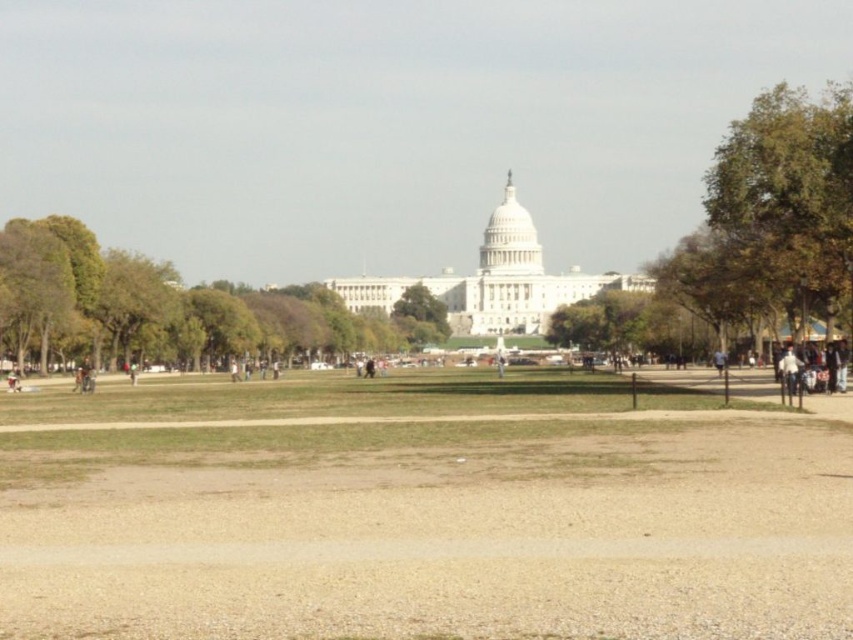
You are a tourist visiting the National Mall and notice two jackets left unattended. One is a white matte jacket at lower right and the other is a light brown leather jacket at center. From your vantage point, which jacket is positioned to the right of the other?

The white matte jacket at lower right is to the right of the light brown leather jacket at center.

You are planning to take a photo of the United States Capitol building from the National Mall. You want to frame the green leafy tree at left and the green leafy tree at center in your shot. Which tree should you position closer to the left edge of your camera frame?

The green leafy tree at left is positioned on the left side of green leafy tree at center, so you should position the green leafy tree at left closer to the left edge of your camera frame.